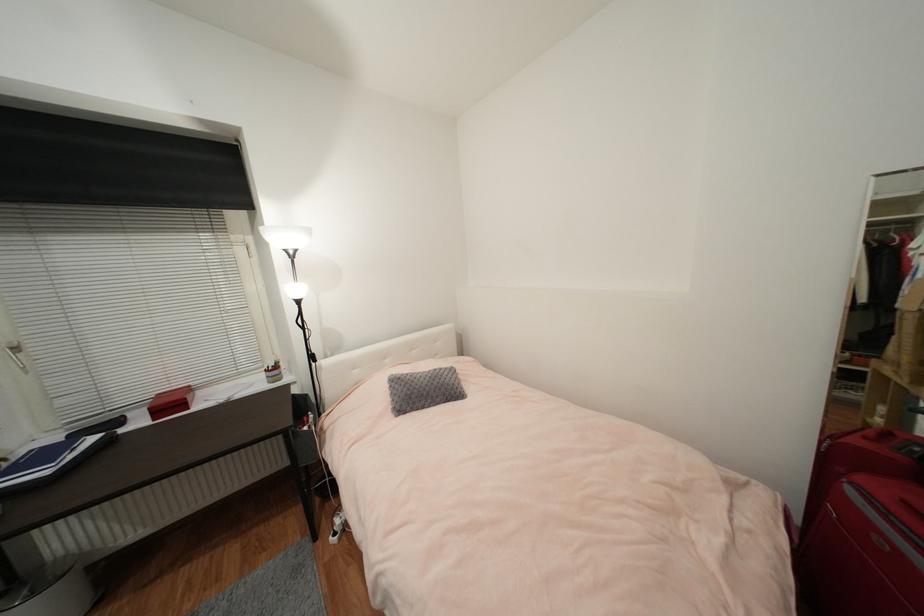
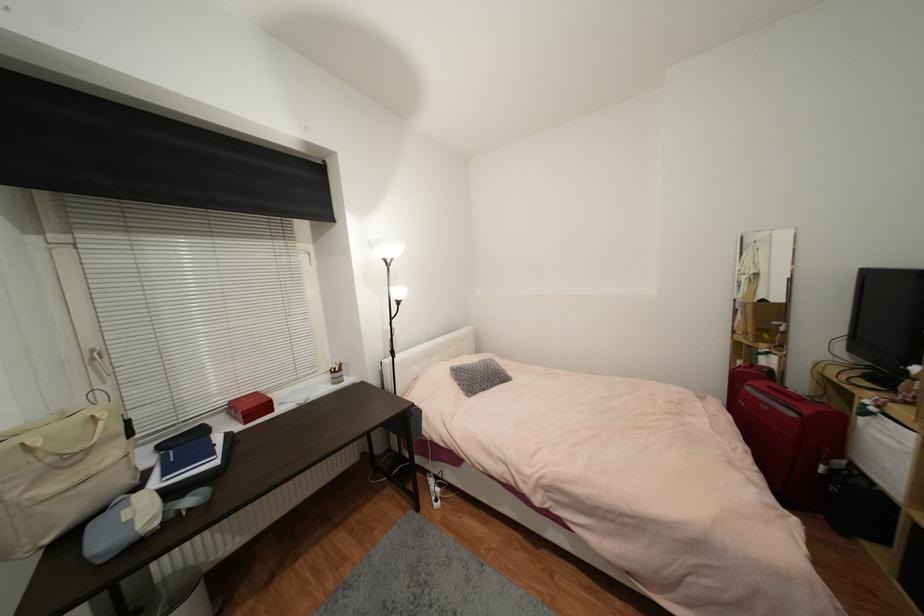
Question: The images are taken continuously from a first-person perspective. In which direction are you moving?

Choices:
 (A) Left
 (B) Right
 (C) Forward
 (D) Backward

Answer: (A)